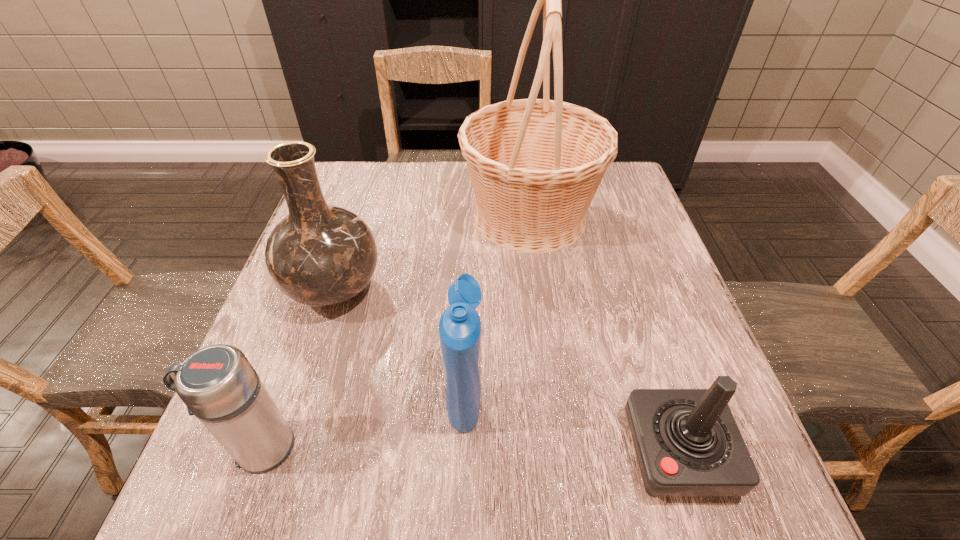
Locate an element on the screen. This screenshot has height=540, width=960. free space between the joystick and the thermos bottle is located at coordinates (468, 449).

Find the location of `free space between the joystick and the shampoo`. free space between the joystick and the shampoo is located at coordinates (571, 423).

This screenshot has height=540, width=960. In order to click on free space that is in between the basket and the shampoo in this screenshot , I will do `click(497, 305)`.

Identify the location of free space between the shampoo and the joystick. (571, 423).

The width and height of the screenshot is (960, 540). Identify the location of free spot between the shampoo and the tallest object. [497, 305].

What are the coordinates of `vacant region between the basket and the vase` in the screenshot? It's located at (432, 253).

Identify which object is the fourth nearest to the tallest object. Please provide its 2D coordinates. Your answer should be formatted as a tuple, i.e. [(x, y)], where the tuple contains the x and y coordinates of a point satisfying the conditions above.

[(217, 383)]

Point out which object is positioned as the third nearest to the joystick. Please provide its 2D coordinates. Your answer should be formatted as a tuple, i.e. [(x, y)], where the tuple contains the x and y coordinates of a point satisfying the conditions above.

[(320, 255)]